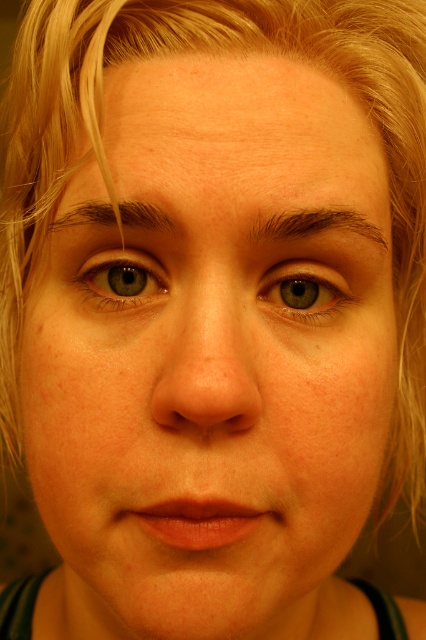
In the scene shown: You are a photographer adjusting the focus of your camera. You want to ensure the green matte eye at center is perfectly sharp. Given its coordinates at point 0.455, 0.716, where should you adjust the focus point to in the frame?

The focus point should be adjusted to the coordinates of the green matte eye at center at point (305, 291) to ensure it is perfectly sharp.

You are a photographer analyzing facial features in the portrait. You notice the green matte eye at upper left and the brown textured eyebrow at upper center. Which of these two features has a greater width?

The brown textured eyebrow at upper center is wider than the green matte eye at upper left, so the brown textured eyebrow at upper center has a greater width.